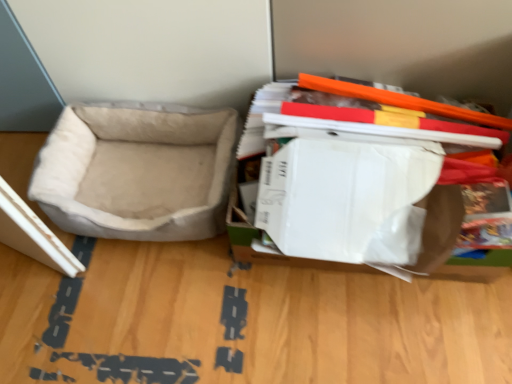
Where is `beige suede dog bed at left`? This screenshot has width=512, height=384. beige suede dog bed at left is located at coordinates (136, 172).

This screenshot has height=384, width=512. Describe the element at coordinates (136, 172) in the screenshot. I see `beige suede dog bed at left` at that location.

Measure the distance between white cardboard box at right and camera.

The depth of white cardboard box at right is 31.94 inches.

What do you see at coordinates (344, 194) in the screenshot? This screenshot has height=384, width=512. I see `white cardboard box at right` at bounding box center [344, 194].

This screenshot has width=512, height=384. Find the location of `white cardboard box at right`. white cardboard box at right is located at coordinates (344, 194).

Consider the image. In order to face white cardboard box at right, should I rotate leftwards or rightwards?

To face it directly, rotate right by 13.734 degrees.

Locate an element on the screen. This screenshot has width=512, height=384. beige suede dog bed at left is located at coordinates (136, 172).

Is beige suede dog bed at left to the left of white cardboard box at right from the viewer's perspective?

Indeed, beige suede dog bed at left is positioned on the left side of white cardboard box at right.

Is beige suede dog bed at left positioned behind white cardboard box at right?

Yes, beige suede dog bed at left is behind white cardboard box at right.

Which is in front, point (115, 113) or point (286, 127)?

The point (286, 127) is closer to the camera.

From the image's perspective, is beige suede dog bed at left above or below white cardboard box at right?

beige suede dog bed at left is above white cardboard box at right.

From a real-world perspective, between beige suede dog bed at left and white cardboard box at right, who is vertically lower?

beige suede dog bed at left, from a real-world perspective.

Does beige suede dog bed at left have a lesser width compared to white cardboard box at right?

Yes.

Considering the sizes of beige suede dog bed at left and white cardboard box at right in the image, is beige suede dog bed at left taller or shorter than white cardboard box at right?

beige suede dog bed at left is shorter than white cardboard box at right.

Considering the relative sizes of beige suede dog bed at left and white cardboard box at right in the image provided, is beige suede dog bed at left bigger than white cardboard box at right?

Incorrect, beige suede dog bed at left is not larger than white cardboard box at right.

Would you say beige suede dog bed at left is outside white cardboard box at right?

Yes, beige suede dog bed at left is not within white cardboard box at right.

Is beige suede dog bed at left beside white cardboard box at right?

beige suede dog bed at left is not next to white cardboard box at right, and they're not touching.

Is beige suede dog bed at left turned away from white cardboard box at right?

No, white cardboard box at right is not at the back of beige suede dog bed at left.

How different are the orientations of beige suede dog bed at left and white cardboard box at right in degrees?

There is a 3.68-degree angle between the facing directions of beige suede dog bed at left and white cardboard box at right.

Measure the distance from beige suede dog bed at left to white cardboard box at right.

A distance of 11.96 inches exists between beige suede dog bed at left and white cardboard box at right.

In the image, there is a beige suede dog bed at left. At what (x,y) coordinates should I click in order to perform the action: click on storage box below it (from the image's perspective). Please return your answer as a coordinate pair (x, y). The height and width of the screenshot is (384, 512). Looking at the image, I should click on (344, 194).

Considering the positions of objects white cardboard box at right and beige suede dog bed at left in the image provided, who is more to the left, white cardboard box at right or beige suede dog bed at left?

Positioned to the left is beige suede dog bed at left.

In the image, is white cardboard box at right positioned in front of or behind beige suede dog bed at left?

white cardboard box at right is in front of beige suede dog bed at left.

Is point (301, 159) closer or farther from the camera than point (64, 220)?

Point (301, 159) is closer to the camera than point (64, 220).

From the image's perspective, relative to beige suede dog bed at left, is white cardboard box at right above or below?

Based on their image positions, white cardboard box at right is located beneath beige suede dog bed at left.

From a real-world perspective, is white cardboard box at right located higher than beige suede dog bed at left?

Yes.

Does white cardboard box at right have a lesser width compared to beige suede dog bed at left?

Incorrect, the width of white cardboard box at right is not less than that of beige suede dog bed at left.

Can you confirm if white cardboard box at right is taller than beige suede dog bed at left?

Indeed, white cardboard box at right has a greater height compared to beige suede dog bed at left.

Does white cardboard box at right have a smaller size compared to beige suede dog bed at left?

No, white cardboard box at right is not smaller than beige suede dog bed at left.

Does white cardboard box at right contain beige suede dog bed at left?

No, beige suede dog bed at left is not a part of white cardboard box at right.

Is white cardboard box at right in contact with beige suede dog bed at left?

They are not placed beside each other.

Is white cardboard box at right turned away from beige suede dog bed at left?

That's not correct — white cardboard box at right is not looking away from beige suede dog bed at left.

Measure the distance from white cardboard box at right to beige suede dog bed at left.

white cardboard box at right is 11.96 inches from beige suede dog bed at left.

Identify the location of dog bed above the white cardboard box at right (from the image's perspective). (136, 172).

Identify the location of dog bed behind the white cardboard box at right. The width and height of the screenshot is (512, 384). (136, 172).

Identify the location of storage box that is in front of the beige suede dog bed at left. This screenshot has height=384, width=512. (344, 194).